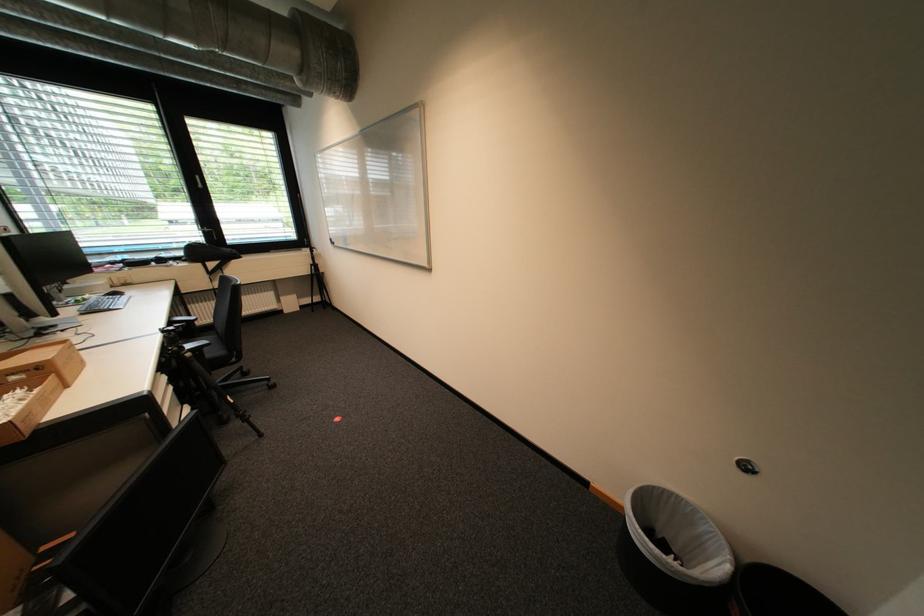
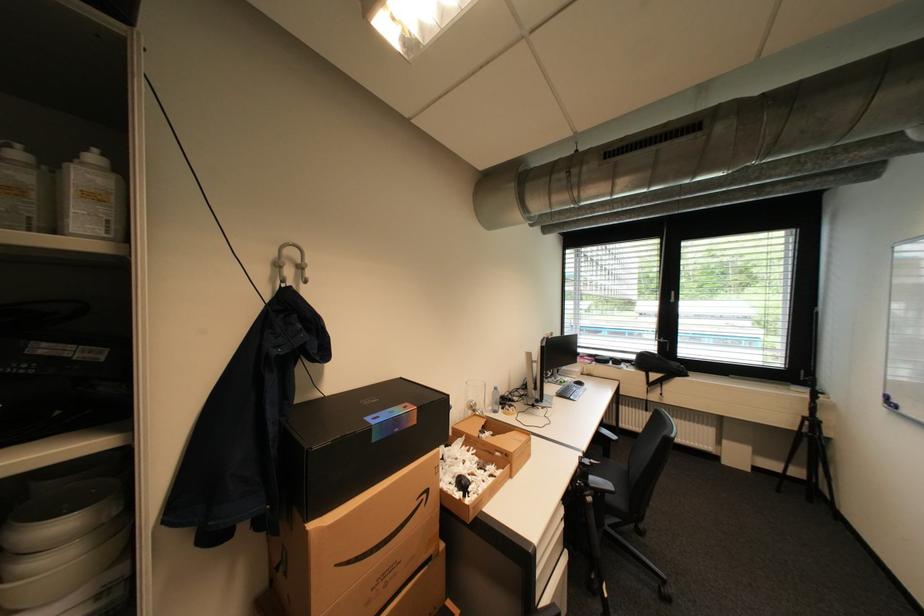
Where in the second image is the point corresponding to (321,262) from the first image?

(815, 415)